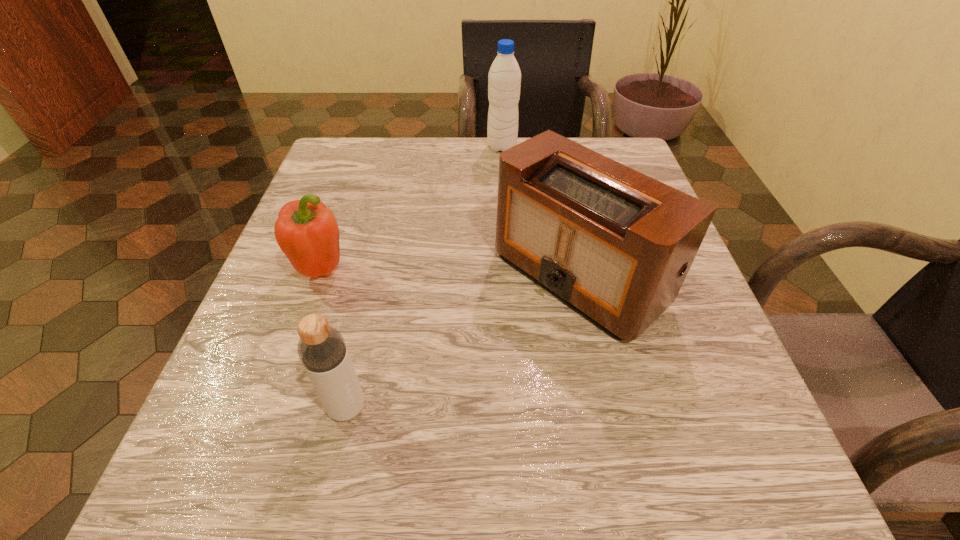
At what (x,y) coordinates should I click in order to perform the action: click on vacant area in the image that satisfies the following two spatial constraints: 1. on the back side of the third object from right to left; 2. on the right side of the farthest object. Please return your answer as a coordinate pair (x, y). The image size is (960, 540). Looking at the image, I should click on (406, 147).

Where is `blank space that satisfies the following two spatial constraints: 1. on the front side of the tallest object; 2. on the left side of the radio receiver`? blank space that satisfies the following two spatial constraints: 1. on the front side of the tallest object; 2. on the left side of the radio receiver is located at coordinates (511, 276).

Image resolution: width=960 pixels, height=540 pixels. In order to click on vacant space that satisfies the following two spatial constraints: 1. on the back side of the tallest object; 2. on the right side of the bottle in this screenshot , I will do `click(406, 147)`.